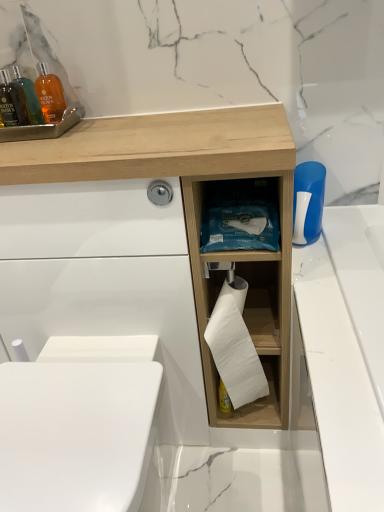
Question: Can you confirm if translucent orange bottle at upper left, positioned as the 2th mouthwash in front-to-back order, is wider than white matte toilet paper at center?

Choices:
 (A) yes
 (B) no

Answer: (B)

Question: From a real-world perspective, is translucent orange bottle at upper left, positioned as the 2th mouthwash in front-to-back order, physically above white matte toilet paper at center?

Choices:
 (A) yes
 (B) no

Answer: (A)

Question: Is translucent orange bottle at upper left, marked as the 1th mouthwash in a back-to-front arrangement, positioned behind white matte toilet paper at center?

Choices:
 (A) no
 (B) yes

Answer: (B)

Question: Is translucent orange bottle at upper left, marked as the 1th mouthwash in a back-to-front arrangement, at the left side of white matte toilet paper at center?

Choices:
 (A) yes
 (B) no

Answer: (A)

Question: Is translucent orange bottle at upper left, marked as the 1th mouthwash in a back-to-front arrangement, looking in the opposite direction of white matte toilet paper at center?

Choices:
 (A) no
 (B) yes

Answer: (A)

Question: Considering the positions of translucent amber bottle at upper left, the 2th mouthwash positioned from the back, and blue plastic brush at right in the image, is translucent amber bottle at upper left, the 2th mouthwash positioned from the back, taller or shorter than blue plastic brush at right?

Choices:
 (A) short
 (B) tall

Answer: (B)

Question: From the image's perspective, relative to blue plastic brush at right, is translucent amber bottle at upper left, the 2th mouthwash positioned from the back, above or below?

Choices:
 (A) above
 (B) below

Answer: (A)

Question: Considering the positions of point (1, 73) and point (314, 230), is point (1, 73) closer or farther from the camera than point (314, 230)?

Choices:
 (A) farther
 (B) closer

Answer: (A)

Question: Is translucent amber bottle at upper left, which is counted as the first mouthwash, starting from the front, inside or outside of blue plastic brush at right?

Choices:
 (A) inside
 (B) outside

Answer: (B)

Question: Is blue plastic brush at right spatially inside translucent orange bottle at upper left, positioned as the 2th mouthwash in front-to-back order, or outside of it?

Choices:
 (A) outside
 (B) inside

Answer: (A)

Question: From the image's perspective, relative to translucent orange bottle at upper left, positioned as the 2th mouthwash in front-to-back order, is blue plastic brush at right above or below?

Choices:
 (A) above
 (B) below

Answer: (B)

Question: Considering the positions of blue plastic brush at right and translucent orange bottle at upper left, positioned as the 2th mouthwash in front-to-back order, in the image, is blue plastic brush at right wider or thinner than translucent orange bottle at upper left, positioned as the 2th mouthwash in front-to-back order,?

Choices:
 (A) wide
 (B) thin

Answer: (A)

Question: Is blue plastic brush at right in front of or behind translucent orange bottle at upper left, marked as the 1th mouthwash in a back-to-front arrangement, in the image?

Choices:
 (A) front
 (B) behind

Answer: (A)

Question: Considering the relative positions of translucent orange bottle at upper left, positioned as the 2th mouthwash in front-to-back order, and wooden tissue box at center in the image provided, is translucent orange bottle at upper left, positioned as the 2th mouthwash in front-to-back order, to the left or to the right of wooden tissue box at center?

Choices:
 (A) left
 (B) right

Answer: (A)

Question: From the image's perspective, is translucent orange bottle at upper left, marked as the 1th mouthwash in a back-to-front arrangement, located above or below wooden tissue box at center?

Choices:
 (A) above
 (B) below

Answer: (A)